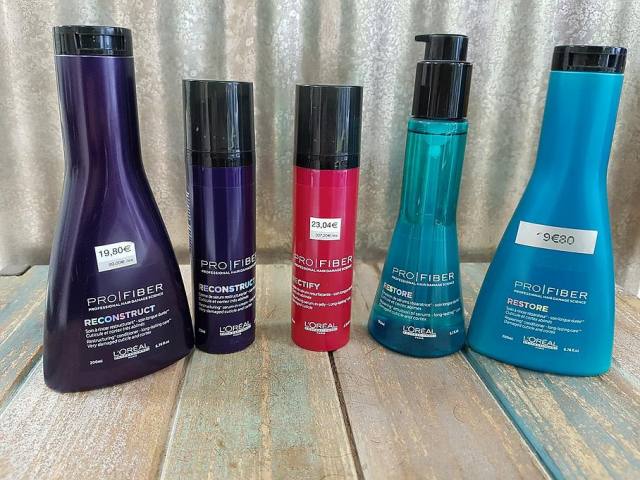
What are the coordinates of `purple container with black top` in the screenshot? It's located at (66, 38), (57, 381), (130, 97), (164, 242).